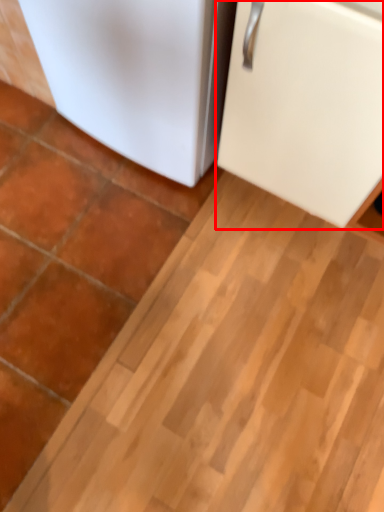
Question: From the image's perspective, where is refrigerator (annotated by the red box) located relative to refrigerator?

Choices:
 (A) above
 (B) below

Answer: (B)